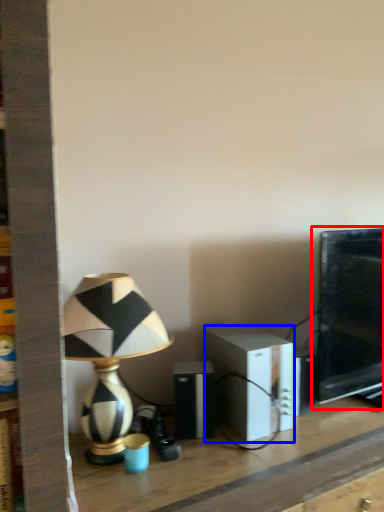
Question: Among these objects, which one is farthest to the camera, computer monitor (highlighted by a red box) or speaker (highlighted by a blue box)?

Choices:
 (A) computer monitor
 (B) speaker

Answer: (A)